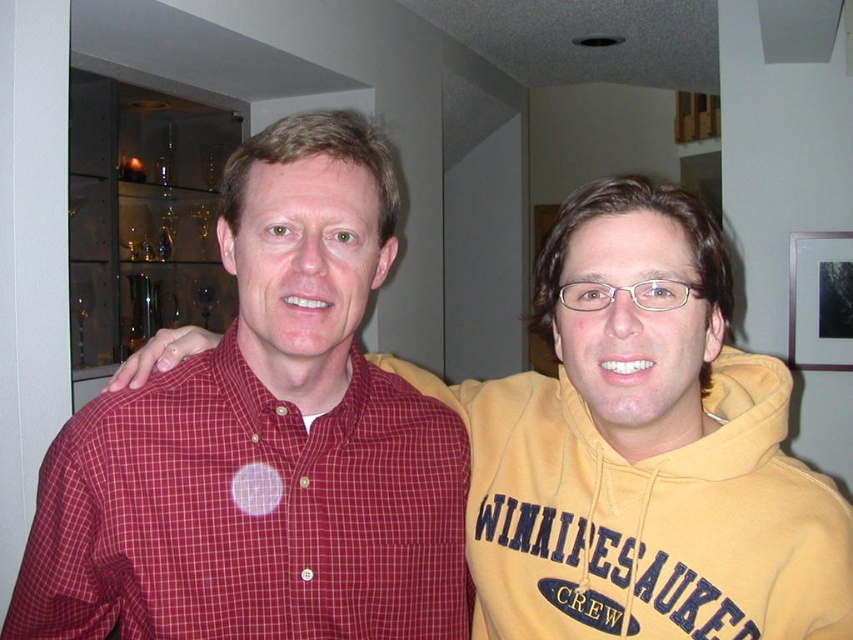
Based on the photo, you are a photographer setting up for a portrait. You need to ensure that both the matte red shirt at left and the checkered cotton shirt at center are in focus. Given that your camera has a depth of field that can cover 16 centimeters, will both shirts be in focus?

The matte red shirt at left and the checkered cotton shirt at center are 15.93 centimeters apart, which is within the 16 centimeter depth of field. Therefore, both shirts will be in focus.

You are trying to decide which shirt to wear for a casual day out. The matte red shirt at left is wider than the checkered cotton shirt at center. Which shirt has a greater width?

The matte red shirt at left has a greater width than the checkered cotton shirt at center.